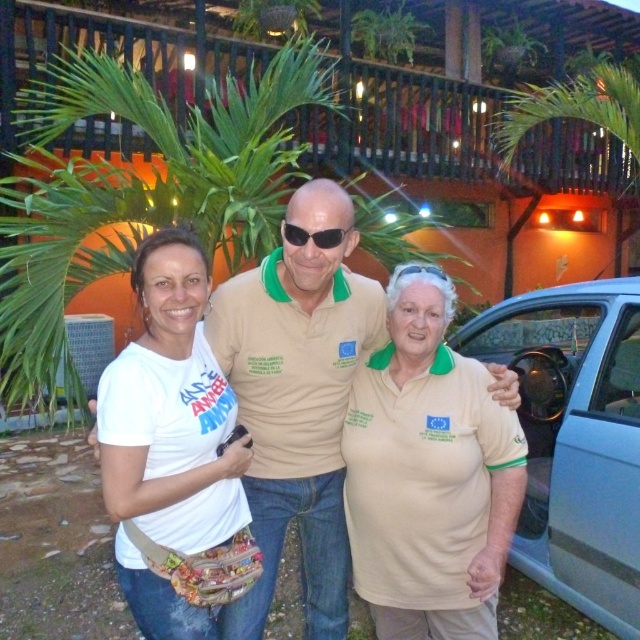
Question: Does beige cotton polo shirt at center appear over white fabric shirt at center?

Choices:
 (A) no
 (B) yes

Answer: (A)

Question: Which point is farther to the camera?

Choices:
 (A) white cotton shirt at left
 (B) light blue metallic car at right
 (C) sunglasses at center

Answer: (B)

Question: Can you confirm if white cotton shirt at left is positioned to the right of white fabric shirt at center?

Choices:
 (A) no
 (B) yes

Answer: (B)

Question: Does light blue metallic car at right have a greater width compared to sunglasses at center?

Choices:
 (A) yes
 (B) no

Answer: (A)

Question: Which point is farther to the camera?

Choices:
 (A) light blue metallic car at right
 (B) sunglasses at center
 (C) beige cotton polo shirt at center
 (D) white cotton shirt at left

Answer: (A)

Question: Considering the real-world distances, which object is farthest from the white cotton shirt at left?

Choices:
 (A) beige cotton polo shirt at center
 (B) clear plastic goggles at center
 (C) sunglasses at center

Answer: (B)